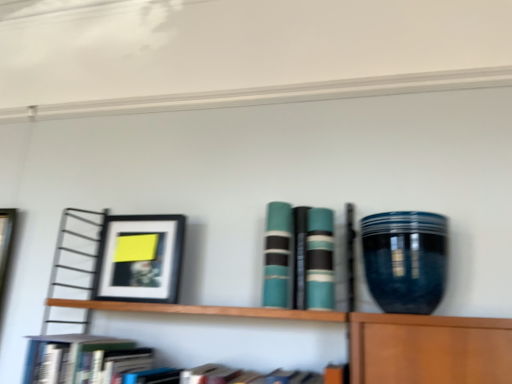
Question: Is teal matte book at center, the third book positioned from the left, aimed at matte black picture frame at left?

Choices:
 (A) yes
 (B) no

Answer: (B)

Question: Does teal matte book at center, the 2th book in the right-to-left sequence, have a lesser width compared to matte black picture frame at left?

Choices:
 (A) no
 (B) yes

Answer: (B)

Question: Can you confirm if teal matte book at center, the third book positioned from the left, is taller than matte black picture frame at left?

Choices:
 (A) yes
 (B) no

Answer: (B)

Question: Does teal matte book at center, the 2th book in the right-to-left sequence, lie in front of matte black picture frame at left?

Choices:
 (A) yes
 (B) no

Answer: (A)

Question: From a real-world perspective, is glossy ceramic vase at right positioned above or below hardcover book at lower left, placed as the fourth book when sorted from right to left?

Choices:
 (A) below
 (B) above

Answer: (B)

Question: Visually, is glossy ceramic vase at right positioned to the left or to the right of hardcover book at lower left, the 1th book viewed from the left?

Choices:
 (A) right
 (B) left

Answer: (A)

Question: Is point (362, 231) closer or farther from the camera than point (99, 357)?

Choices:
 (A) farther
 (B) closer

Answer: (A)

Question: Is glossy ceramic vase at right inside or outside of hardcover book at lower left, the 1th book viewed from the left?

Choices:
 (A) outside
 (B) inside

Answer: (A)

Question: Looking at their shapes, would you say teal matte book at center, the second book in the left-to-right sequence, is wider or thinner than hardcover book at lower left, placed as the fourth book when sorted from right to left?

Choices:
 (A) thin
 (B) wide

Answer: (A)

Question: Does point (275, 206) appear closer or farther from the camera than point (113, 350)?

Choices:
 (A) farther
 (B) closer

Answer: (A)

Question: From the image's perspective, relative to hardcover book at lower left, placed as the fourth book when sorted from right to left, is teal matte book at center, the third book from the right, above or below?

Choices:
 (A) below
 (B) above

Answer: (B)

Question: Based on their sizes in the image, would you say teal matte book at center, the second book in the left-to-right sequence, is bigger or smaller than hardcover book at lower left, placed as the fourth book when sorted from right to left?

Choices:
 (A) big
 (B) small

Answer: (B)

Question: Is hardcover book at lower left, placed as the fourth book when sorted from right to left, taller or shorter than teal matte book at center, the 4th book positioned from the left?

Choices:
 (A) tall
 (B) short

Answer: (B)

Question: Considering their positions, is hardcover book at lower left, placed as the fourth book when sorted from right to left, located in front of or behind teal matte book at center, the 4th book positioned from the left?

Choices:
 (A) behind
 (B) front

Answer: (B)